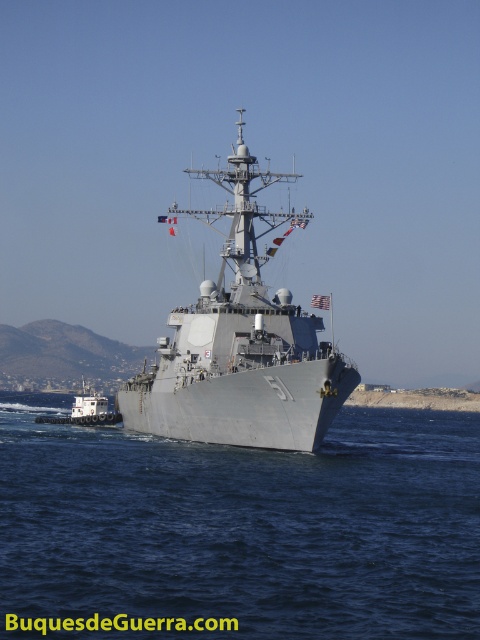
Question: Can you confirm if gray metallic water at center is positioned above white matte tugboat at lower left?

Choices:
 (A) yes
 (B) no

Answer: (B)

Question: Does gray metallic warship at center have a lesser width compared to white matte tugboat at lower left?

Choices:
 (A) no
 (B) yes

Answer: (A)

Question: Estimate the real-world distances between objects in this image. Which object is farther from the gray metallic warship at center?

Choices:
 (A) gray metallic water at center
 (B) white matte tugboat at lower left

Answer: (B)

Question: Which point appears farthest from the camera in this image?

Choices:
 (A) (88, 436)
 (B) (235, 186)

Answer: (A)

Question: In this image, where is gray metallic warship at center located relative to white matte tugboat at lower left?

Choices:
 (A) above
 (B) below

Answer: (A)

Question: Estimate the real-world distances between objects in this image. Which object is farther from the gray metallic warship at center?

Choices:
 (A) gray metallic water at center
 (B) white matte tugboat at lower left

Answer: (B)